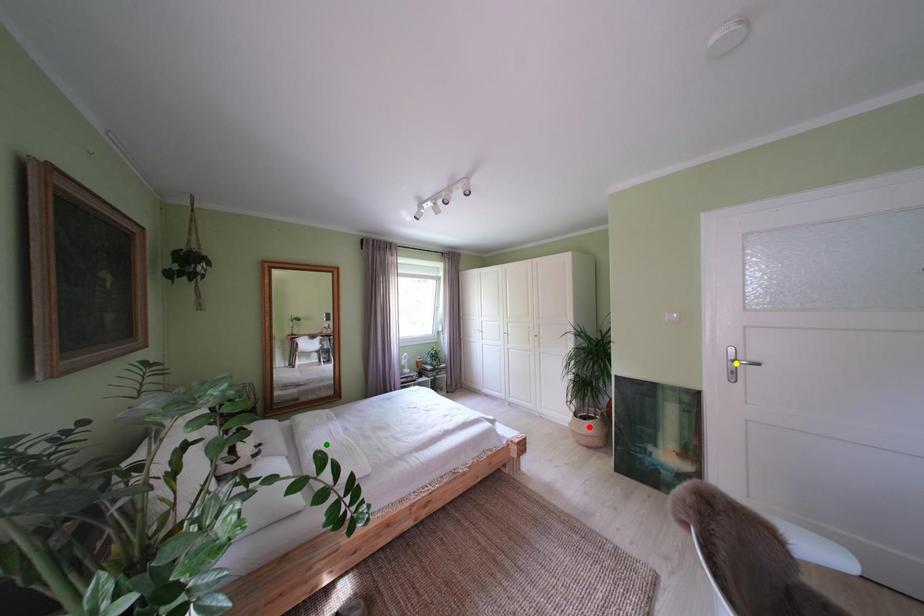
Order these from nearest to farthest:
- yellow point
- green point
- red point

yellow point, green point, red point